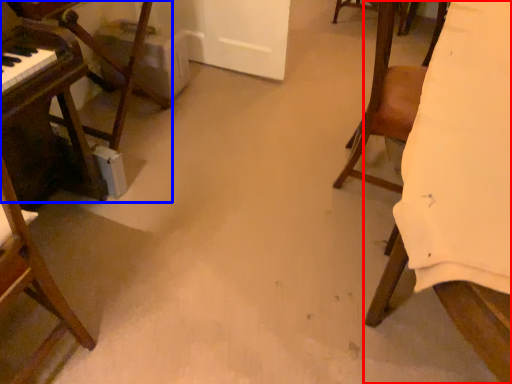
Question: Which point is closer to the camera, furniture (highlighted by a red box) or furniture (highlighted by a blue box)?

Choices:
 (A) furniture
 (B) furniture

Answer: (A)